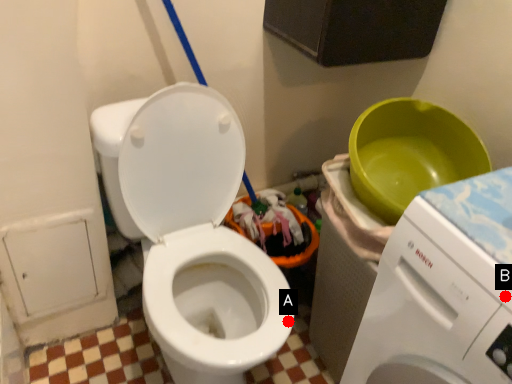
Question: Two points are circled on the image, labeled by A and B beside each circle. Among these points, which one is farthest from the camera?

Choices:
 (A) A is further
 (B) B is further

Answer: (A)